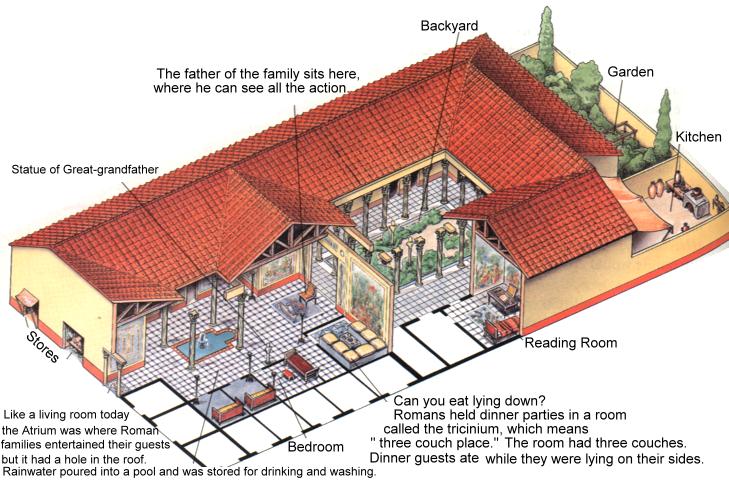
Locate an element on the screen. This screenshot has height=480, width=729. 1 kitchen is located at coordinates (677, 195).